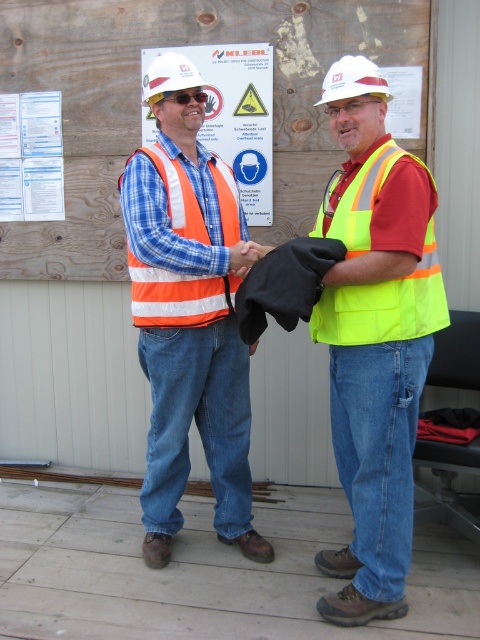
Question: Can you confirm if wooden signboard at center is wider than orange reflective safety vest at center?

Choices:
 (A) yes
 (B) no

Answer: (A)

Question: Does orange reflective vest at center have a smaller size compared to reflective plastic sign at upper center?

Choices:
 (A) yes
 (B) no

Answer: (B)

Question: Which is farther from the neon yellow reflective safety vest at center?

Choices:
 (A) white paper at upper center
 (B) reflective plastic sign at upper center
 (C) white paper at upper left

Answer: (C)

Question: Based on their relative distances, which object is farther from the white hard hat at center?

Choices:
 (A) neon yellow reflective safety vest at center
 (B) orange reflective vest at center
 (C) reflective plastic sign at upper center

Answer: (B)

Question: Which of the following is the farthest from the observer?

Choices:
 (A) (272, 173)
 (B) (365, 90)
 (C) (194, 193)
 (D) (25, 113)

Answer: (D)

Question: Is wooden signboard at center bigger than neon yellow reflective safety vest at center?

Choices:
 (A) no
 (B) yes

Answer: (B)